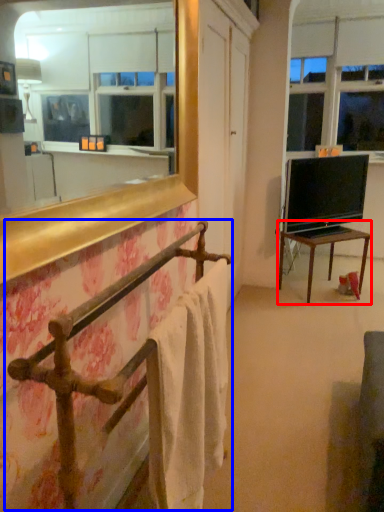
Question: Which point is further to the camera, table (highlighted by a red box) or balustrade (highlighted by a blue box)?

Choices:
 (A) table
 (B) balustrade

Answer: (A)